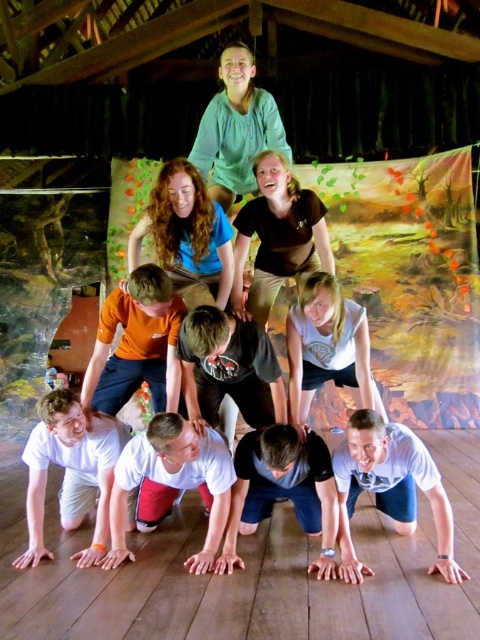
Question: Which of these objects is positioned farthest from the dark blue jeans at center?

Choices:
 (A) white matte shirt at lower center
 (B) white cotton shirt at lower right

Answer: (A)

Question: Can you confirm if orange matte t-shirt at center is positioned to the right of dark blue jeans at center?

Choices:
 (A) no
 (B) yes

Answer: (A)

Question: Is white matte t-shirt at lower center wider than orange matte t-shirt at center?

Choices:
 (A) no
 (B) yes

Answer: (B)

Question: Which point appears closest to the camera in this image?

Choices:
 (A) (212, 480)
 (B) (384, 461)

Answer: (B)

Question: Which point appears closest to the camera in this image?

Choices:
 (A) (x=171, y=413)
 (B) (x=178, y=384)

Answer: (A)

Question: Does dark blue jeans at center appear under matte black shirt at center?

Choices:
 (A) no
 (B) yes

Answer: (B)